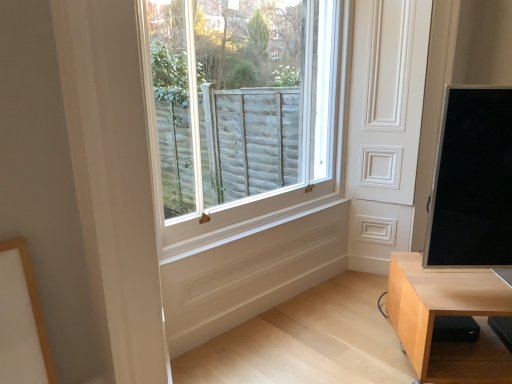
You are a GUI agent. You are given a task and a screenshot of the screen. Output one action in this format:
    pyautogui.click(x=<x>, y=<y>)
    Task: Click on the free spot below black glossy screen at right (from a real-world perspective)
    Image resolution: width=512 pixels, height=384 pixels.
    Given the screenshot: What is the action you would take?
    [x=470, y=292]